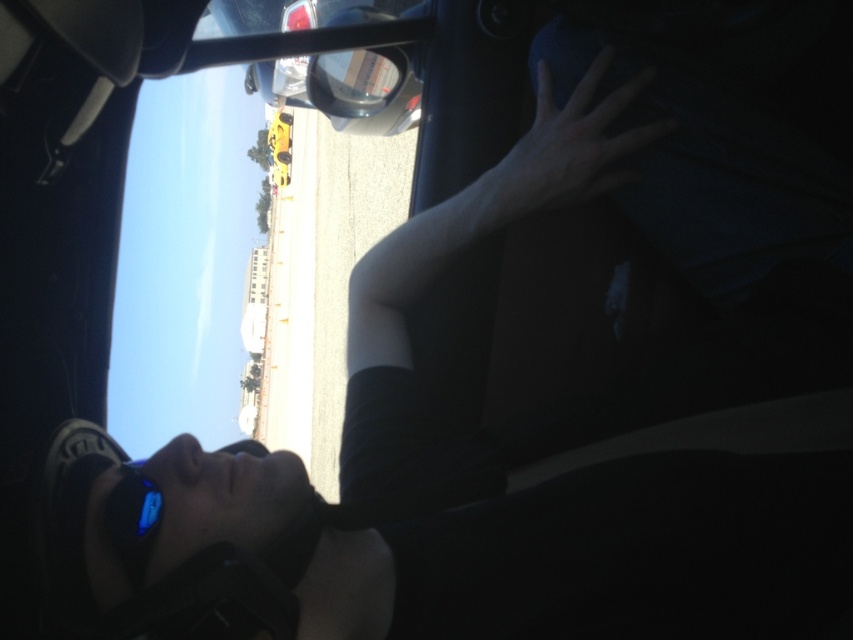
Does skinny white hand at upper center have a smaller size compared to sunglasses at lower left?

No.

Who is lower down, skinny white hand at upper center or sunglasses at lower left?

sunglasses at lower left is lower down.

At what (x,y) coordinates should I click in order to perform the action: click on skinny white hand at upper center. Please return your answer as a coordinate pair (x, y). The image size is (853, 640). Looking at the image, I should click on (566, 148).